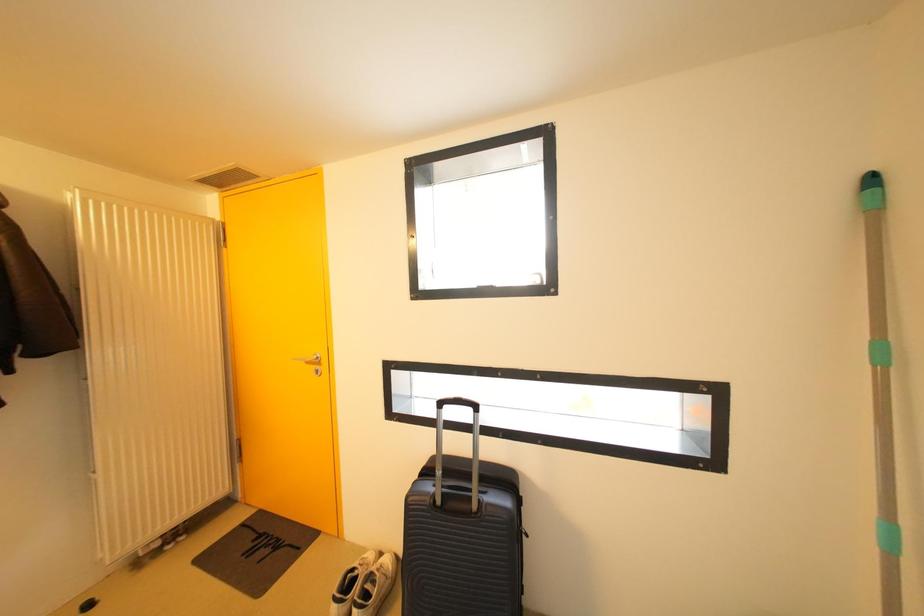
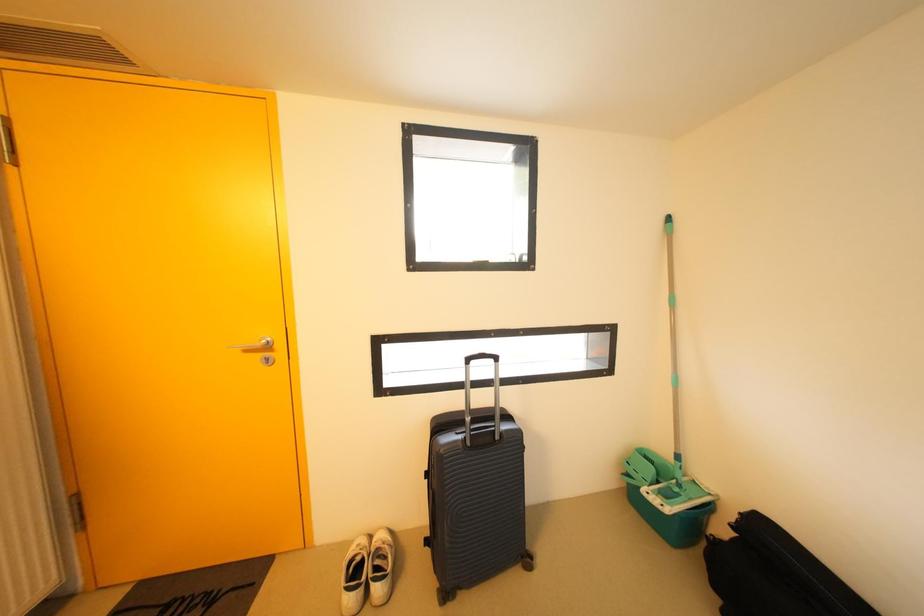
Question: Based on the continuous images, in which direction is the camera rotating? Reply with the corresponding letter.

Choices:
 (A) Left
 (B) Right
 (C) Up
 (D) Down

Answer: (B)